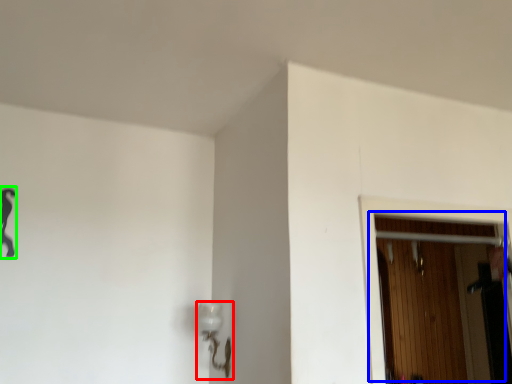
Question: Which is nearer to the lamp (highlighted by a red box)? door (highlighted by a blue box) or woman (highlighted by a green box).

Choices:
 (A) door
 (B) woman

Answer: (B)